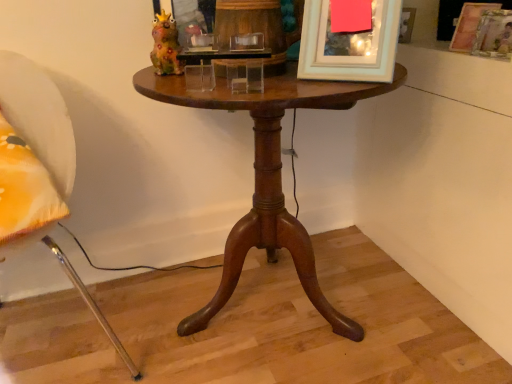
Question: Considering the positions of wooden picture frame at upper right, which ranks as the second picture frame in right-to-left order, and white fabric chair at left in the image, is wooden picture frame at upper right, which ranks as the second picture frame in right-to-left order, wider or thinner than white fabric chair at left?

Choices:
 (A) wide
 (B) thin

Answer: (B)

Question: Considering the relative positions of wooden picture frame at upper right, the 1th picture frame from the back, and white fabric chair at left in the image provided, is wooden picture frame at upper right, the 1th picture frame from the back, to the left or to the right of white fabric chair at left?

Choices:
 (A) left
 (B) right

Answer: (B)

Question: Which of these objects is positioned farthest from the white fabric chair at left?

Choices:
 (A) mahogany wood table at center
 (B) white matte picture frame at upper center, acting as the 3th picture frame starting from the right
 (C) wooden picture frame at upper right, the 1th picture frame from the back
 (D) wooden picture frame at upper right, arranged as the 3th picture frame when viewed from the left

Answer: (D)

Question: Which is nearer to the wooden picture frame at upper right, which ranks as the second picture frame in right-to-left order?

Choices:
 (A) white matte picture frame at upper center, positioned as the 3th picture frame in back-to-front order
 (B) mahogany wood table at center
 (C) wooden picture frame at upper right, positioned as the 2th picture frame in front-to-back order
 (D) white fabric chair at left

Answer: (C)